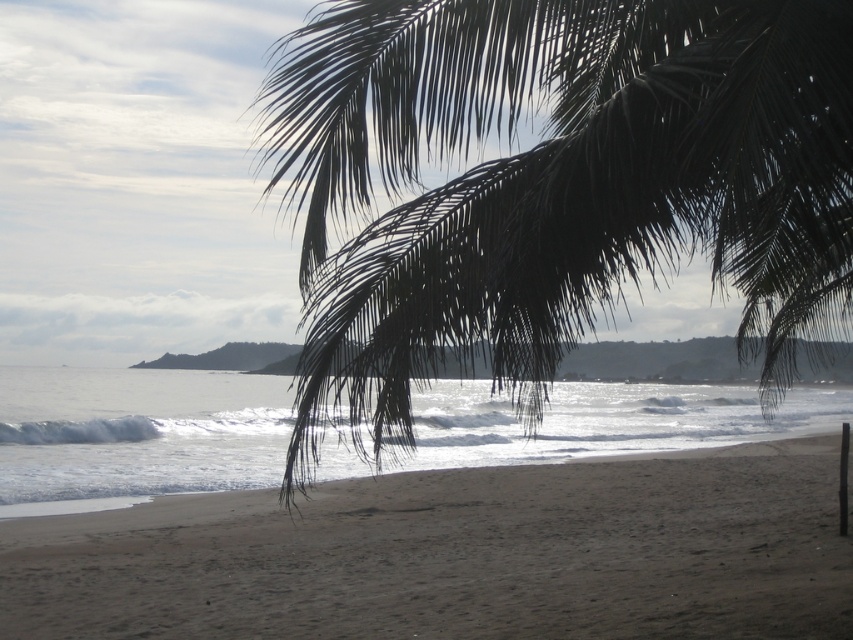
Question: Which point is closer to the camera?

Choices:
 (A) green leafy palm tree at upper right
 (B) dark brown sand at lower center

Answer: (A)

Question: Among these objects, which one is nearest to the camera?

Choices:
 (A) dark brown sand at lower center
 (B) green leafy palm tree at upper right

Answer: (B)

Question: Is green leafy palm tree at upper right above dark brown sand at lower center?

Choices:
 (A) no
 (B) yes

Answer: (B)

Question: Observing the image, what is the correct spatial positioning of green leafy palm tree at upper right in reference to dark brown sand at lower center?

Choices:
 (A) above
 (B) below

Answer: (A)

Question: Which object appears farthest from the camera in this image?

Choices:
 (A) green leafy palm tree at upper right
 (B) dark brown sand at lower center

Answer: (B)

Question: In this image, where is green leafy palm tree at upper right located relative to dark brown sand at lower center?

Choices:
 (A) below
 (B) above

Answer: (B)